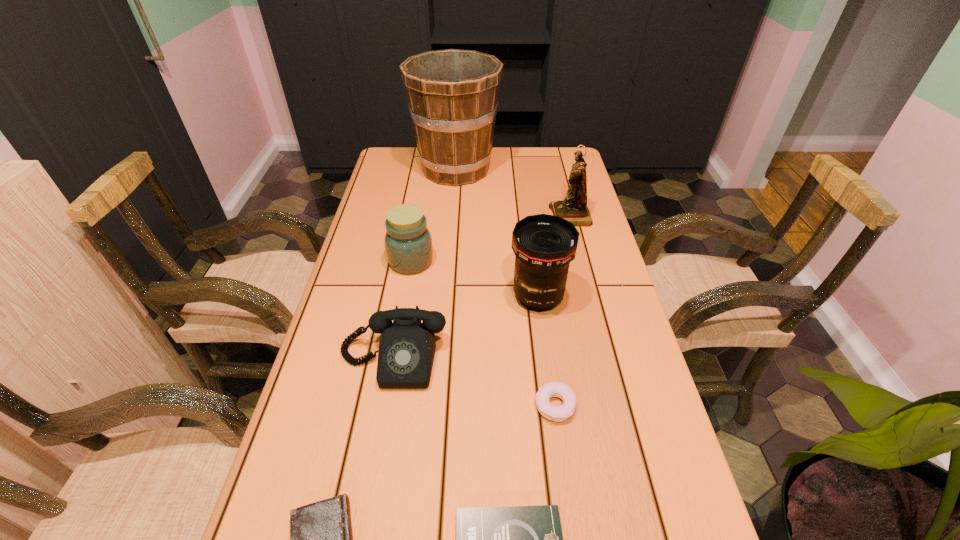
Locate an element on the screen. This screenshot has height=540, width=960. free spot between the figurine and the fifth tallest object is located at coordinates (482, 288).

Find the location of a particular element. The image size is (960, 540). vacant space that's between the jar and the telephoto lens is located at coordinates (474, 279).

Locate which object ranks in proximity to the figurine. Please provide its 2D coordinates. Your answer should be formatted as a tuple, i.e. [(x, y)], where the tuple contains the x and y coordinates of a point satisfying the conditions above.

[(452, 94)]

Select which object appears as the closest to the bucket. Please provide its 2D coordinates. Your answer should be formatted as a tuple, i.e. [(x, y)], where the tuple contains the x and y coordinates of a point satisfying the conditions above.

[(573, 208)]

Where is `free location that satisfies the following two spatial constraints: 1. on the front side of the doughnut; 2. on the right side of the tallest object`? The image size is (960, 540). free location that satisfies the following two spatial constraints: 1. on the front side of the doughnut; 2. on the right side of the tallest object is located at coordinates (437, 406).

Image resolution: width=960 pixels, height=540 pixels. Identify the location of vacant space that satisfies the following two spatial constraints: 1. on the front-facing side of the seventh nearest object; 2. on the front side of the third farthest object. (582, 261).

The image size is (960, 540). I want to click on vacant area that satisfies the following two spatial constraints: 1. on the back side of the fourth tallest object; 2. on the right side of the farthest object, so click(427, 169).

Identify the location of free space that satisfies the following two spatial constraints: 1. on the front-facing side of the second farthest object; 2. on the front side of the fourth farthest object. The height and width of the screenshot is (540, 960). (591, 297).